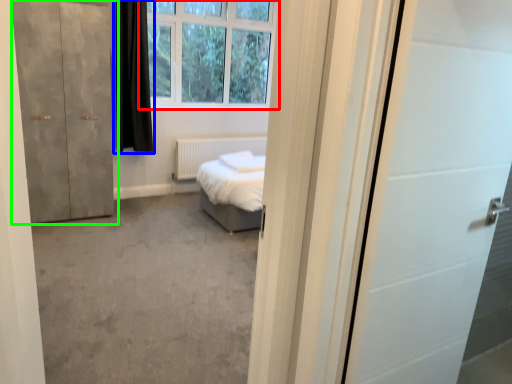
Question: Which is farther away from window (highlighted by a red box)? curtain (highlighted by a blue box) or door (highlighted by a green box)?

Choices:
 (A) curtain
 (B) door

Answer: (B)